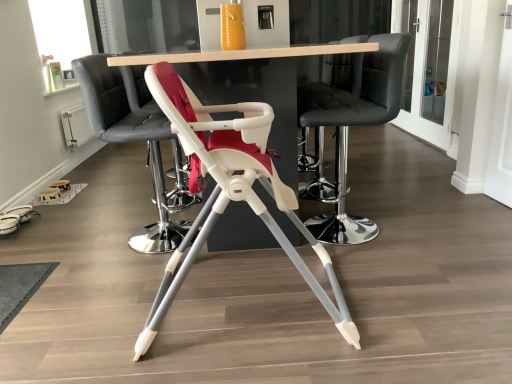
This screenshot has height=384, width=512. What are the coordinates of `vacant area that is situated to the right of white plastic highchair at center, positioned as the fourth chair in back-to-front order` in the screenshot? It's located at (409, 295).